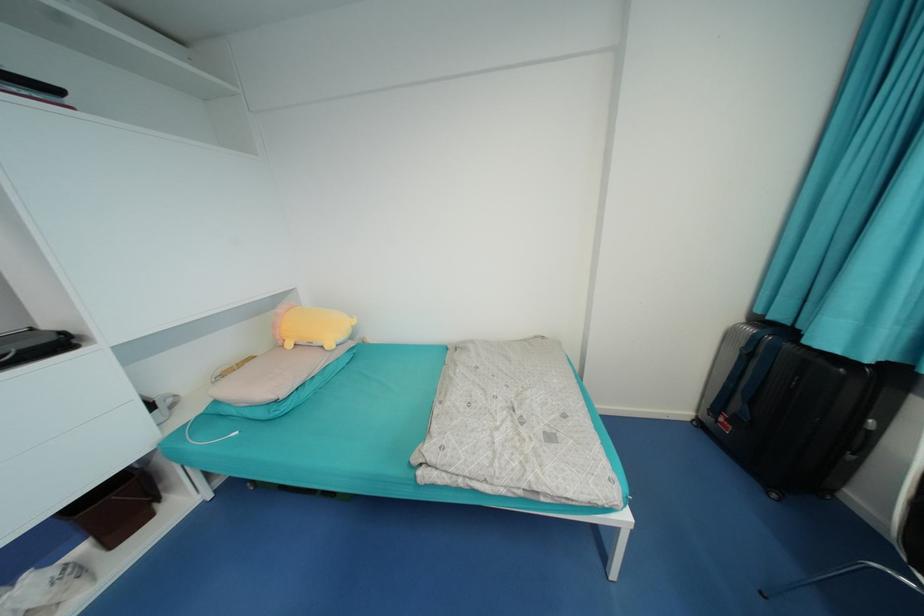
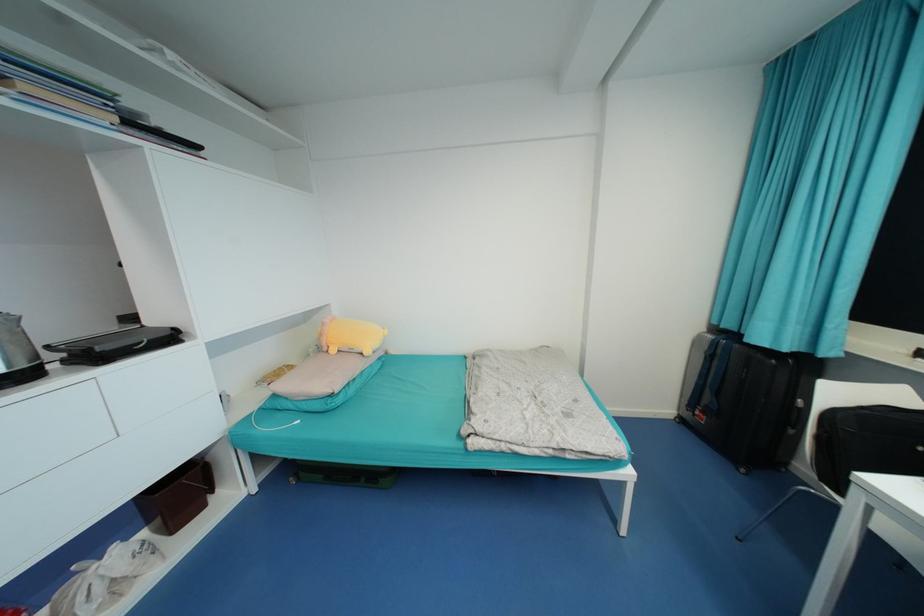
Where in the second image is the point corresponding to (x=760, y=341) from the first image?

(719, 345)